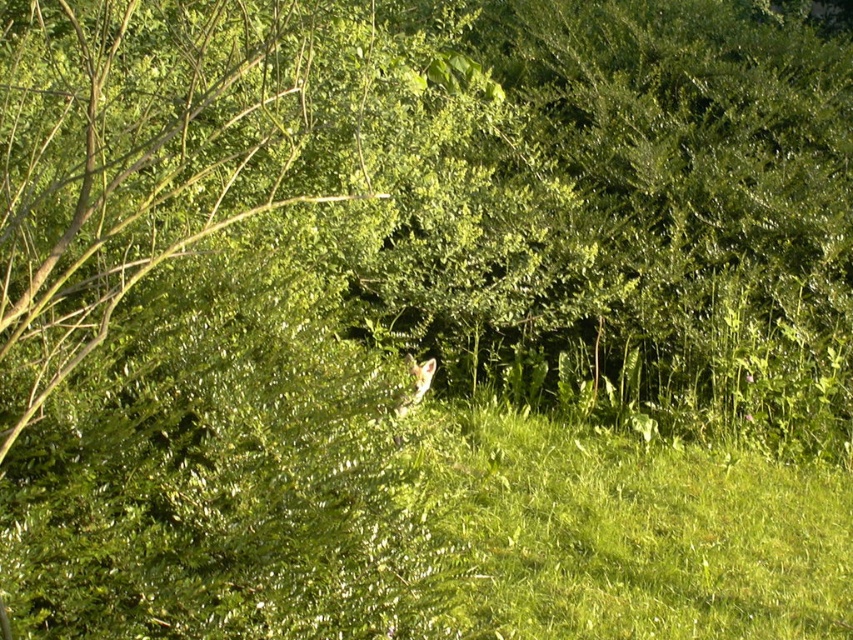
Question: Is green grassy at center above white fur fox at center?

Choices:
 (A) yes
 (B) no

Answer: (B)

Question: Can you confirm if green leafy tree at center is wider than white fur fox at center?

Choices:
 (A) yes
 (B) no

Answer: (A)

Question: Which of the following is the closest to the observer?

Choices:
 (A) green grassy at center
 (B) white fur fox at center

Answer: (A)

Question: Where is green grassy at center located in relation to white fur fox at center in the image?

Choices:
 (A) left
 (B) right

Answer: (B)

Question: Which point is closer to the camera?

Choices:
 (A) (412, 364)
 (B) (294, 54)

Answer: (A)

Question: Which point is farther from the camera taking this photo?

Choices:
 (A) (622, 508)
 (B) (428, 369)

Answer: (B)